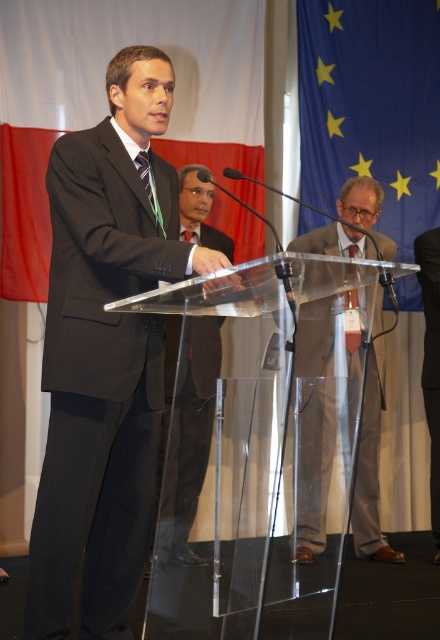
Question: Estimate the real-world distances between objects in this image. Which object is closer to the matte gray suit at center?

Choices:
 (A) black smooth suit at center
 (B) black matte suit at left

Answer: (A)

Question: Which of the following is the closest to the observer?

Choices:
 (A) (191, 344)
 (B) (121, 388)

Answer: (A)

Question: Is matte gray suit at center to the left of black smooth suit at center from the viewer's perspective?

Choices:
 (A) yes
 (B) no

Answer: (A)

Question: Which object is positioned closest to the black matte suit at left?

Choices:
 (A) black matte suit at center
 (B) matte gray suit at center

Answer: (A)

Question: Can you confirm if matte gray suit at center is positioned below black smooth suit at center?

Choices:
 (A) yes
 (B) no

Answer: (A)

Question: From the image, what is the correct spatial relationship of black matte suit at left in relation to black matte suit at center?

Choices:
 (A) above
 (B) below

Answer: (A)